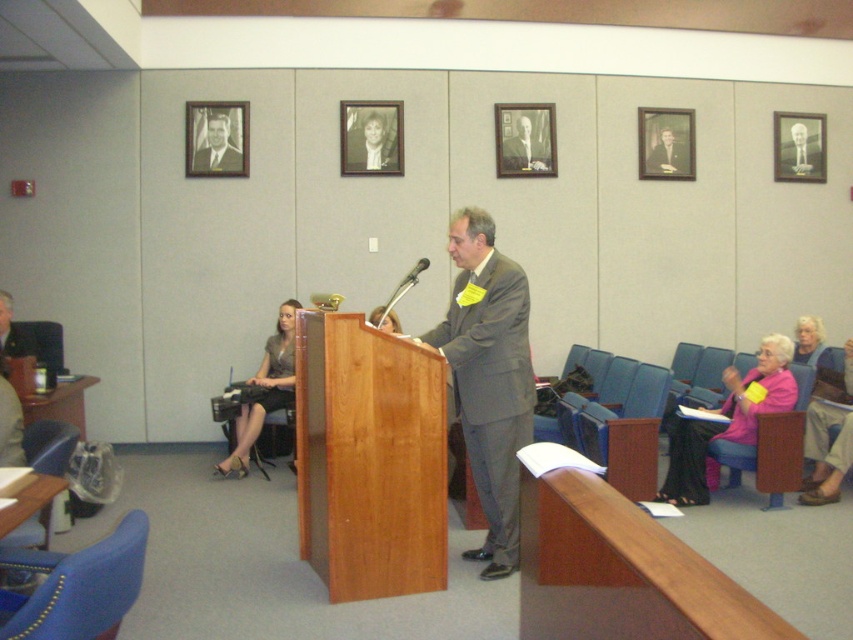
Question: Which of the following is the farthest from the observer?

Choices:
 (A) black wood picture frame at upper center
 (B) blue fabric chair at lower left
 (C) gray suit at center
 (D) metallic gold picture frame at upper right

Answer: (D)

Question: Which of the following is the farthest from the observer?

Choices:
 (A) (534, 161)
 (B) (4, 545)
 (C) (381, 124)

Answer: (A)

Question: Does wooden at right have a larger size compared to metallic silver microphone at center?

Choices:
 (A) no
 (B) yes

Answer: (B)

Question: Is wooden at right smaller than smooth gray suit at center?

Choices:
 (A) no
 (B) yes

Answer: (A)

Question: Is wooden picture frame at upper right thinner than formal suit at center?

Choices:
 (A) no
 (B) yes

Answer: (A)

Question: Which object is farther from the camera taking this photo?

Choices:
 (A) gray suit at center
 (B) black wood picture frame at upper center
 (C) metallic silver chair at lower left

Answer: (B)